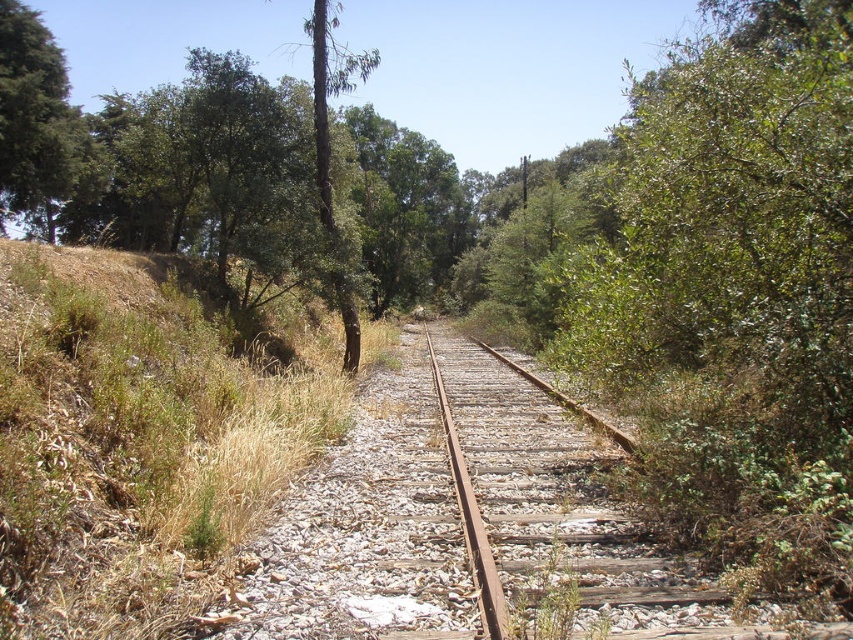
Is dry grass at left bigger than rusty metal train track at center?

Correct, dry grass at left is larger in size than rusty metal train track at center.

Who is shorter, dry grass at left or rusty metal train track at center?

Standing shorter between the two is rusty metal train track at center.

Who is more forward, (223, 502) or (457, 392)?

Positioned in front is point (223, 502).

What are the coordinates of `dry grass at left` in the screenshot? It's located at (141, 436).

Can you confirm if rusty metal train track at center is positioned to the left of green leafy tree at upper left?

In fact, rusty metal train track at center is to the right of green leafy tree at upper left.

Looking at this image, who is higher up, rusty metal train track at center or green leafy tree at upper left?

green leafy tree at upper left

Is point (436, 336) positioned before point (28, 26)?

No.

I want to click on rusty metal train track at center, so click(x=532, y=500).

Is dry grass at left wider than green leafy tree at upper left?

No.

Between dry grass at left and green leafy tree at upper left, which one appears on the left side from the viewer's perspective?

Positioned to the left is green leafy tree at upper left.

Is point (97, 282) farther from camera compared to point (42, 228)?

No, it is not.

The width and height of the screenshot is (853, 640). I want to click on dry grass at left, so click(x=141, y=436).